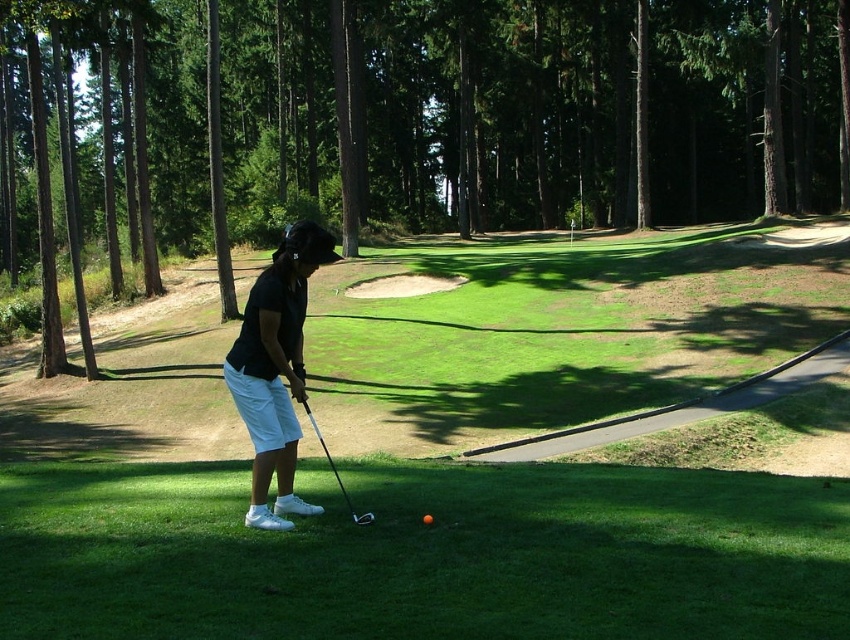
You are a golfer preparing to hit the orange matte golf ball at center. The metallic silver golf club at center is your only club available. Considering their sizes, will the club head fully cover the golf ball when addressing it?

The metallic silver golf club at center is larger in size than orange matte golf ball at center, so yes, the club head will fully cover the golf ball when addressing it.